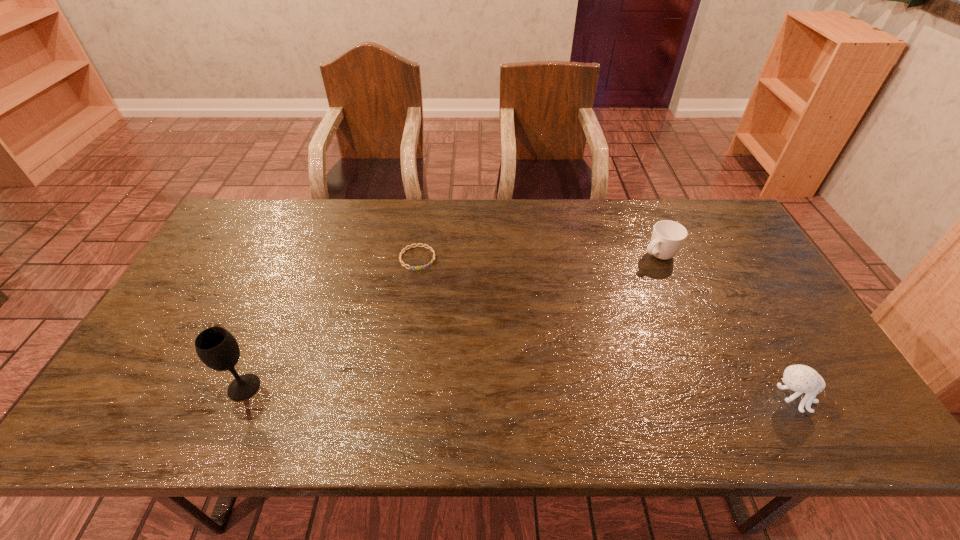
Where is `empty space between the cup and the tallest object`? This screenshot has height=540, width=960. empty space between the cup and the tallest object is located at coordinates (451, 321).

This screenshot has height=540, width=960. I want to click on unoccupied position between the tallest object and the second object from left to right, so click(331, 322).

This screenshot has width=960, height=540. I want to click on free space between the wineglass and the cup, so click(451, 321).

Where is `blank region between the wineglass and the cup`? The image size is (960, 540). blank region between the wineglass and the cup is located at coordinates (451, 321).

Locate an element on the screen. object that is the third closest to the rightmost object is located at coordinates (217, 348).

Where is `object that can be found as the closest to the octopus`? This screenshot has height=540, width=960. object that can be found as the closest to the octopus is located at coordinates (668, 236).

I want to click on vacant area that satisfies the following two spatial constraints: 1. on the front side of the rightmost object; 2. on the front-facing side of the shortest object, so click(x=396, y=398).

I want to click on blank space that satisfies the following two spatial constraints: 1. on the back side of the second object from left to right; 2. on the left side of the leftmost object, so click(300, 258).

The width and height of the screenshot is (960, 540). I want to click on free space that satisfies the following two spatial constraints: 1. on the front side of the shortest object; 2. on the front-facing side of the rightmost object, so click(x=396, y=398).